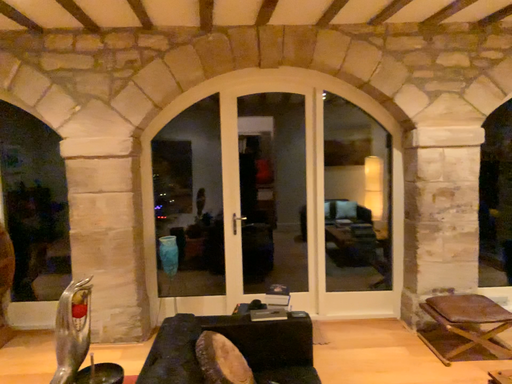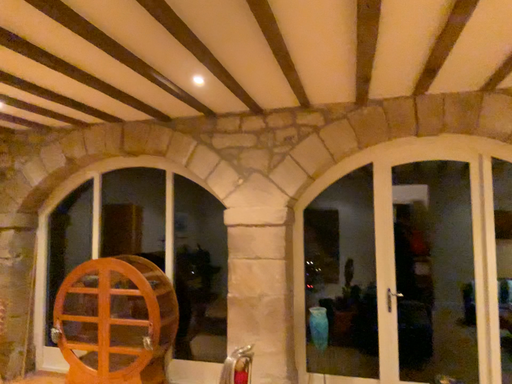
Question: Which way did the camera rotate in the video?

Choices:
 (A) rotated upward
 (B) rotated downward

Answer: (A)